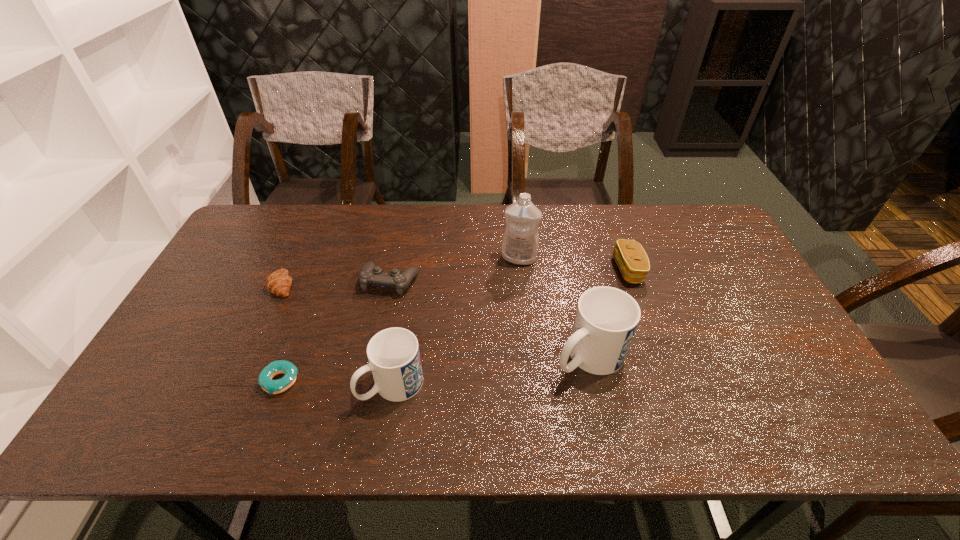
Where is `the rightmost object`? Image resolution: width=960 pixels, height=540 pixels. the rightmost object is located at coordinates (632, 260).

Locate an element on the screen. The width and height of the screenshot is (960, 540). doughnut is located at coordinates (x=274, y=368).

Find the location of a particular element. The height and width of the screenshot is (540, 960). the shortest object is located at coordinates click(274, 368).

The image size is (960, 540). I want to click on vacant space located 0.390m on the left of the third tallest object, so click(201, 384).

Locate an element on the screen. Image resolution: width=960 pixels, height=540 pixels. free spot located 0.290m on the right of the second object from right to left is located at coordinates (738, 356).

Locate an element on the screen. The width and height of the screenshot is (960, 540). vacant space located on the right of the second shortest object is located at coordinates (405, 285).

You are a GUI agent. You are given a task and a screenshot of the screen. Output one action in this format:
    pyautogui.click(x=<x>, y=<y>)
    Task: Click on the vacant space situated on the left of the control
    This screenshot has height=540, width=960.
    Given the screenshot: What is the action you would take?
    pyautogui.click(x=293, y=281)

Locate an element on the screen. The image size is (960, 540). vacant space located on the front of the fifth object from left to right is located at coordinates (523, 296).

This screenshot has width=960, height=540. I want to click on free space located on the zipper side of the fourth shortest object, so click(524, 270).

Where is `free space located on the zipper side of the fourth shortest object`? This screenshot has height=540, width=960. free space located on the zipper side of the fourth shortest object is located at coordinates (538, 270).